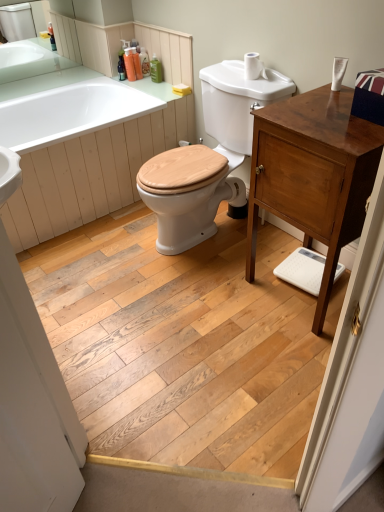
Where is `free spot in front of white matte toilet paper at upper right`? This screenshot has width=384, height=512. free spot in front of white matte toilet paper at upper right is located at coordinates (267, 84).